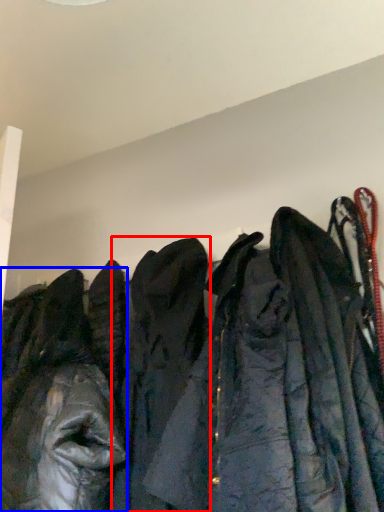
Question: Which object is further to the camera taking this photo, cloak (highlighted by a red box) or jacket (highlighted by a blue box)?

Choices:
 (A) cloak
 (B) jacket

Answer: (B)